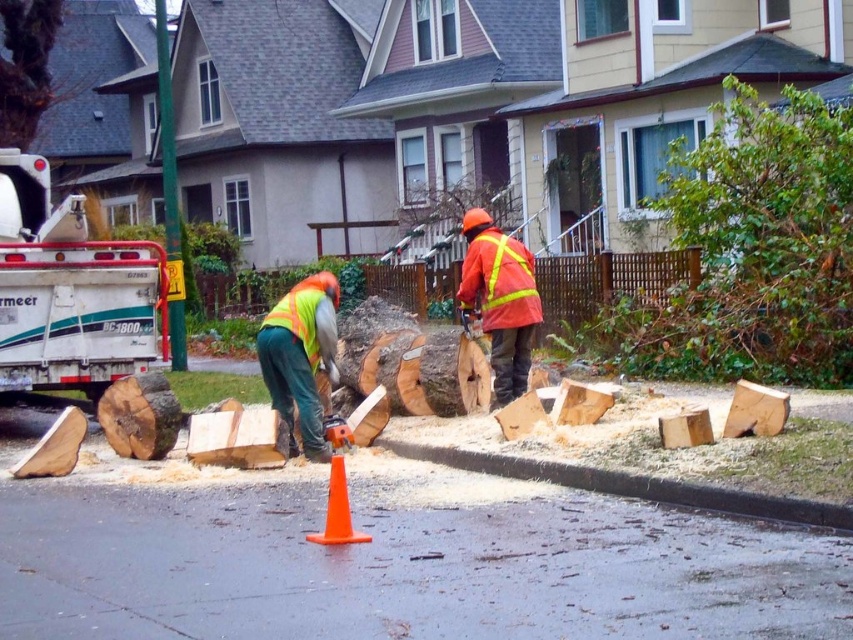
Is orange cone at center wider than high-visibility reflective safety vest at center?

Yes, orange cone at center is wider than high-visibility reflective safety vest at center.

From the picture: Can you confirm if orange cone at center is taller than high-visibility reflective safety vest at center?

No.

Which is behind, point (238, 520) or point (289, 323)?

Positioned behind is point (289, 323).

What are the coordinates of `orange cone at center` in the screenshot? It's located at 401,568.

Does high-visibility reflective vest at center appear under orange reflective vest at center?

Incorrect, high-visibility reflective vest at center is not positioned below orange reflective vest at center.

Which is in front, point (312, 314) or point (498, 371)?

Point (312, 314)

The width and height of the screenshot is (853, 640). Describe the element at coordinates (300, 356) in the screenshot. I see `high-visibility reflective vest at center` at that location.

Where is `high-visibility reflective vest at center`? This screenshot has width=853, height=640. high-visibility reflective vest at center is located at coordinates (300, 356).

Does point (483, 232) lie behind point (347, 500)?

That is True.

Is orange reflective vest at center below orange plastic traffic cone at center?

No.

This screenshot has height=640, width=853. What do you see at coordinates (500, 300) in the screenshot?
I see `orange reflective vest at center` at bounding box center [500, 300].

Locate an element on the screen. The height and width of the screenshot is (640, 853). orange reflective vest at center is located at coordinates (500, 300).